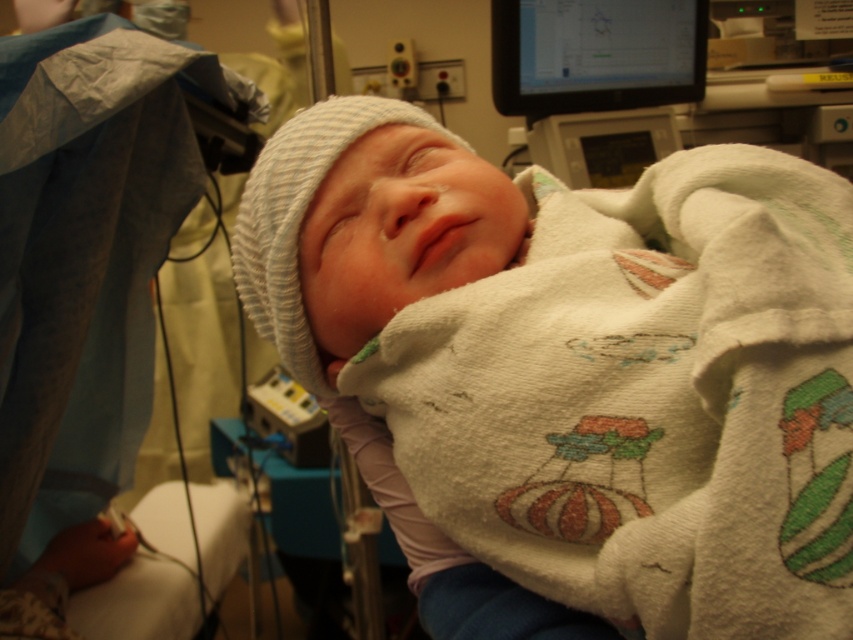
You are a nurse in a hospital room and need to place a medical chart on a surface. You see the white knit hat at center and the black glossy monitor at upper right. Which object has a wider surface area for placing the chart?

The white knit hat at center has a wider surface area than the black glossy monitor at upper right, so the chart can be placed on the white knit hat at center.

You are a nurse in a hospital room. You need to place a small medical device on either the point at (346, 298) or the point at (505, 81). Which point is closer to the camera so that the device will be more visible to the monitor?

Point at (346, 298) is closer to the camera than point at (505, 81), so placing the device there will make it more visible to the monitor.

You are a nurse checking the monitor in the hospital room. You see the white knit hat at center and the black glossy monitor at upper right. Which object is closer to the left side of the frame?

The white knit hat at center is positioned on the left side of the black glossy monitor at upper right, so it is closer to the left side of the frame.